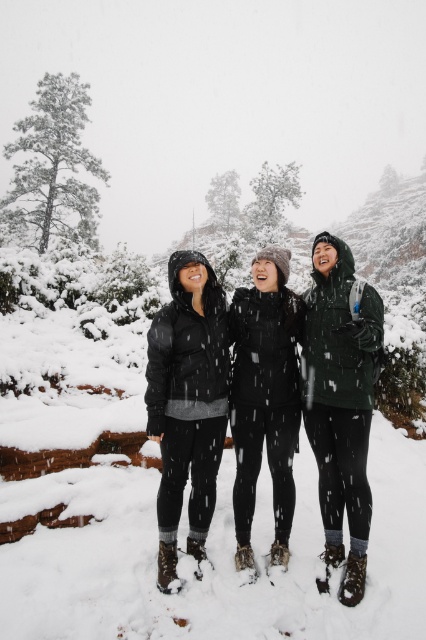
I want to click on matte black jacket at center, so click(187, 403).

Which is more to the left, matte black jacket at center or black fleece jacket at center?

From the viewer's perspective, matte black jacket at center appears more on the left side.

Between point (210, 481) and point (296, 412), which one is positioned behind?

Positioned behind is point (296, 412).

You are a GUI agent. You are given a task and a screenshot of the screen. Output one action in this format:
    pyautogui.click(x=<x>, y=<y>)
    Task: Click on the matte black jacket at center
    Image resolution: width=426 pixels, height=640 pixels.
    Given the screenshot: What is the action you would take?
    pyautogui.click(x=187, y=403)